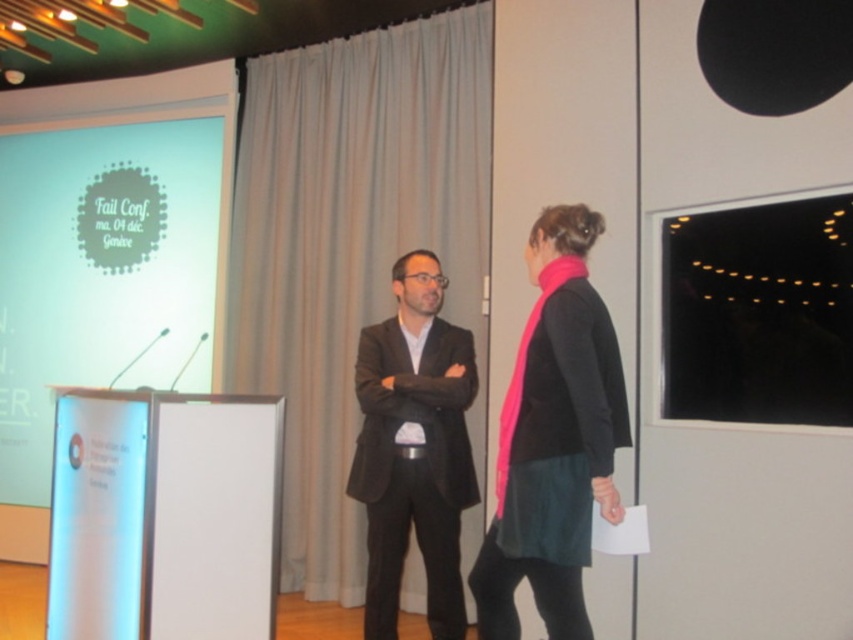
Which is below, white glossy projection screen at upper left or pink matte scarf at right?

pink matte scarf at right is below.

Consider the image. Who is positioned more to the left, white glossy projection screen at upper left or pink matte scarf at right?

white glossy projection screen at upper left is more to the left.

Does point (51, 166) come closer to viewer compared to point (508, 636)?

That is False.

This screenshot has width=853, height=640. Identify the location of white glossy projection screen at upper left. (99, 269).

Looking at this image, can you confirm if white glossy projection screen at upper left is shorter than black matte projection screen at upper right?

No.

Between white glossy projection screen at upper left and black matte projection screen at upper right, which one has less height?

black matte projection screen at upper right is shorter.

Who is more forward, (51, 253) or (706, 362)?

Positioned in front is point (706, 362).

The width and height of the screenshot is (853, 640). I want to click on white glossy projection screen at upper left, so coord(99,269).

Is pink matte scarf at right smaller than matte black suit at center?

Correct, pink matte scarf at right occupies less space than matte black suit at center.

Between pink matte scarf at right and matte black suit at center, which one is positioned higher?

Answer: pink matte scarf at right

Is point (585, 436) positioned behind point (415, 406)?

No, (585, 436) is in front of (415, 406).

The image size is (853, 640). Identify the location of pink matte scarf at right. (553, 438).